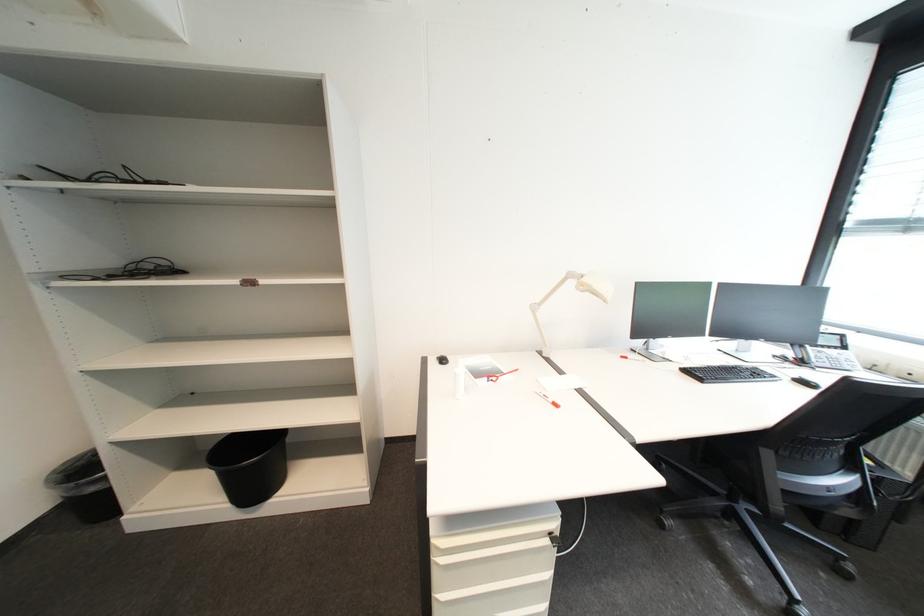
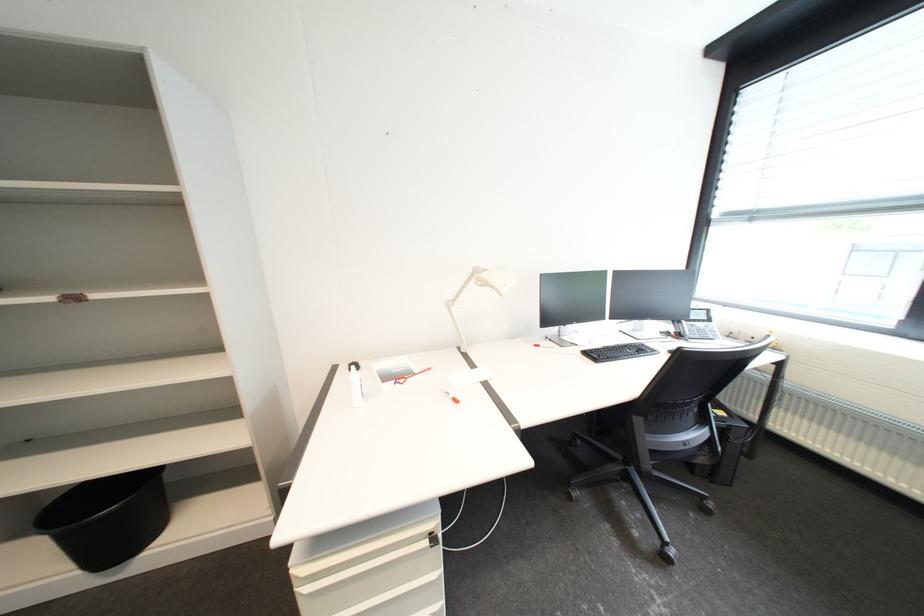
Question: Which direction would the cameraman need to move to produce the second image? Reply with the corresponding letter.

Choices:
 (A) Left
 (B) Right
 (C) Forward
 (D) Backward

Answer: (B)